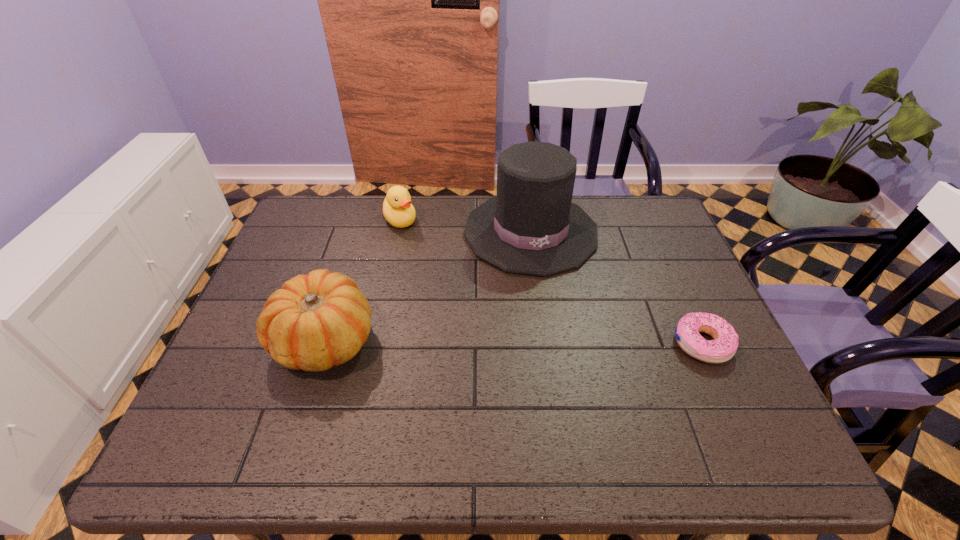
Identify the location of blank area located 0.300m on the front of the second object from right to left with the decoration. The height and width of the screenshot is (540, 960). (571, 370).

You are a GUI agent. You are given a task and a screenshot of the screen. Output one action in this format:
    pyautogui.click(x=<x>, y=<y>)
    Task: Click on the vacant area situated on the face of the duckling
    
    Given the screenshot: What is the action you would take?
    pyautogui.click(x=420, y=255)

I want to click on blank space located on the face of the duckling, so click(420, 255).

Locate an element on the screen. This screenshot has width=960, height=540. vacant space situated on the face of the duckling is located at coordinates (434, 276).

I want to click on dress hat located in the far edge section of the desktop, so click(531, 227).

The width and height of the screenshot is (960, 540). I want to click on duckling positioned at the far edge, so click(x=397, y=208).

At what (x,y) coordinates should I click in order to perform the action: click on object that is positioned at the near edge. Please return your answer as a coordinate pair (x, y). Image resolution: width=960 pixels, height=540 pixels. Looking at the image, I should click on (314, 322).

Locate an element on the screen. object located at the left edge is located at coordinates (314, 322).

The width and height of the screenshot is (960, 540). I want to click on object that is at the right edge, so click(x=723, y=347).

Where is `object positioned at the near left corner`? The width and height of the screenshot is (960, 540). object positioned at the near left corner is located at coordinates point(314,322).